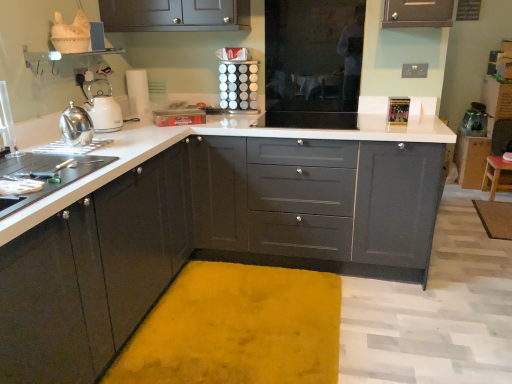
Question: Is matte gray cabinets at center, which is counted as the second cabinetry, starting from the right, at the left side of yellow plush bath mat at center, acting as the second bath mat starting from the back?

Choices:
 (A) no
 (B) yes

Answer: (A)

Question: Does matte gray cabinets at center, the second cabinetry positioned from the front, touch yellow plush bath mat at center, which is counted as the 2th bath mat, starting from the right?

Choices:
 (A) no
 (B) yes

Answer: (A)

Question: Can you confirm if matte gray cabinets at center, which is counted as the second cabinetry, starting from the right, is bigger than yellow plush bath mat at center, the 2th bath mat positioned from the top?

Choices:
 (A) yes
 (B) no

Answer: (A)

Question: Is matte gray cabinets at center, the second cabinetry positioned from the front, closer to the viewer compared to yellow plush bath mat at center, placed as the first bath mat when sorted from bottom to top?

Choices:
 (A) no
 (B) yes

Answer: (A)

Question: Would you say yellow plush bath mat at center, placed as the first bath mat when sorted from bottom to top, is part of matte gray cabinets at center, the second cabinetry positioned from the front,'s contents?

Choices:
 (A) no
 (B) yes

Answer: (A)

Question: Is matte gray cabinets at center, which is counted as the second cabinetry, starting from the right, wider than yellow plush bath mat at center, the 2th bath mat positioned from the top?

Choices:
 (A) yes
 (B) no

Answer: (B)

Question: Does yellow plush bath mat at lower right, the 1th bath mat from the top, have a greater width compared to metallic silver spice rack at upper center?

Choices:
 (A) yes
 (B) no

Answer: (A)

Question: Can you confirm if yellow plush bath mat at lower right, acting as the 2th bath mat starting from the bottom, is smaller than metallic silver spice rack at upper center?

Choices:
 (A) yes
 (B) no

Answer: (A)

Question: Is yellow plush bath mat at lower right, the 1th bath mat from the top, at the right side of metallic silver spice rack at upper center?

Choices:
 (A) no
 (B) yes

Answer: (B)

Question: From a real-world perspective, is yellow plush bath mat at lower right, marked as the first bath mat in a right-to-left arrangement, under metallic silver spice rack at upper center?

Choices:
 (A) yes
 (B) no

Answer: (A)

Question: Is yellow plush bath mat at lower right, which is counted as the first bath mat, starting from the back, next to metallic silver spice rack at upper center and touching it?

Choices:
 (A) no
 (B) yes

Answer: (A)

Question: From a real-world perspective, does yellow plush bath mat at lower right, the 2th bath mat viewed from the left, stand above metallic silver spice rack at upper center?

Choices:
 (A) no
 (B) yes

Answer: (A)

Question: Does yellow plush bath mat at center, placed as the 1th bath mat when sorted from front to back, contain matte black cabinets at left, which is the first cabinetry in left-to-right order?

Choices:
 (A) yes
 (B) no

Answer: (B)